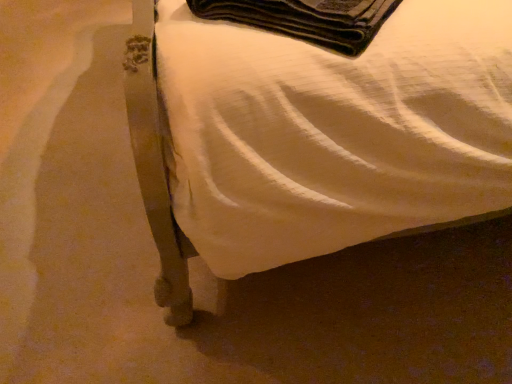
Question: Considering the relative sizes of metallic bed frame at lower left and black felt wallet at upper center in the image provided, is metallic bed frame at lower left taller than black felt wallet at upper center?

Choices:
 (A) no
 (B) yes

Answer: (B)

Question: Can you confirm if metallic bed frame at lower left is shorter than black felt wallet at upper center?

Choices:
 (A) no
 (B) yes

Answer: (A)

Question: Is metallic bed frame at lower left at the right side of black felt wallet at upper center?

Choices:
 (A) no
 (B) yes

Answer: (B)

Question: Is metallic bed frame at lower left to the left of black felt wallet at upper center from the viewer's perspective?

Choices:
 (A) no
 (B) yes

Answer: (A)

Question: From a real-world perspective, is metallic bed frame at lower left on top of black felt wallet at upper center?

Choices:
 (A) yes
 (B) no

Answer: (B)

Question: Would you say black felt wallet at upper center is part of metallic bed frame at lower left's contents?

Choices:
 (A) no
 (B) yes

Answer: (B)

Question: Can you confirm if black felt wallet at upper center is shorter than metallic bed frame at lower left?

Choices:
 (A) no
 (B) yes

Answer: (B)

Question: Is black felt wallet at upper center turned away from metallic bed frame at lower left?

Choices:
 (A) yes
 (B) no

Answer: (A)

Question: Does black felt wallet at upper center have a smaller size compared to metallic bed frame at lower left?

Choices:
 (A) no
 (B) yes

Answer: (B)

Question: From a real-world perspective, is black felt wallet at upper center below metallic bed frame at lower left?

Choices:
 (A) no
 (B) yes

Answer: (A)

Question: Considering the relative sizes of black felt wallet at upper center and metallic bed frame at lower left in the image provided, is black felt wallet at upper center bigger than metallic bed frame at lower left?

Choices:
 (A) yes
 (B) no

Answer: (B)

Question: From the image's perspective, is black felt wallet at upper center under metallic bed frame at lower left?

Choices:
 (A) yes
 (B) no

Answer: (A)

Question: From a real-world perspective, is metallic bed frame at lower left positioned above or below black felt wallet at upper center?

Choices:
 (A) below
 (B) above

Answer: (A)